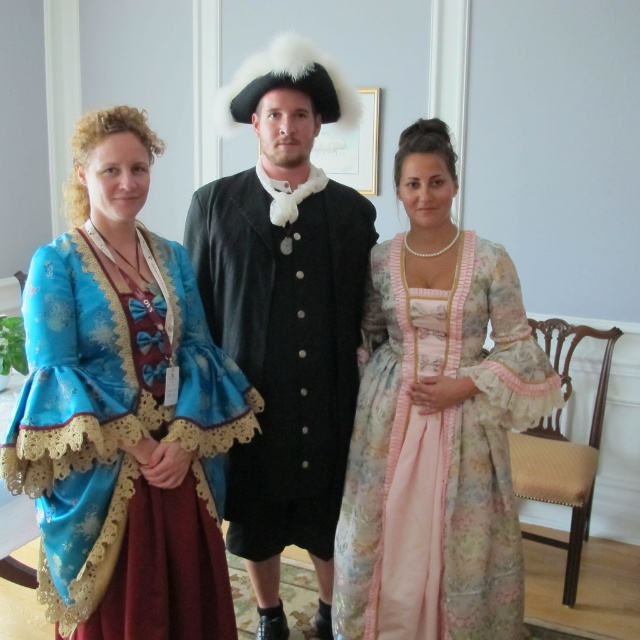
Question: Based on their relative distances, which object is nearer to the matte blue fabric dress at left?

Choices:
 (A) floral silk dress at center
 (B) black satin coat at center

Answer: (B)

Question: Among these objects, which one is farthest from the camera?

Choices:
 (A) matte blue fabric dress at left
 (B) black satin coat at center

Answer: (B)

Question: Is matte blue fabric dress at left closer to camera compared to floral silk dress at center?

Choices:
 (A) yes
 (B) no

Answer: (A)

Question: Can you confirm if matte blue fabric dress at left is positioned above black satin coat at center?

Choices:
 (A) yes
 (B) no

Answer: (A)

Question: Observing the image, what is the correct spatial positioning of matte blue fabric dress at left in reference to black satin coat at center?

Choices:
 (A) left
 (B) right

Answer: (A)

Question: Which object appears closest to the camera in this image?

Choices:
 (A) matte blue fabric dress at left
 (B) floral silk dress at center

Answer: (A)